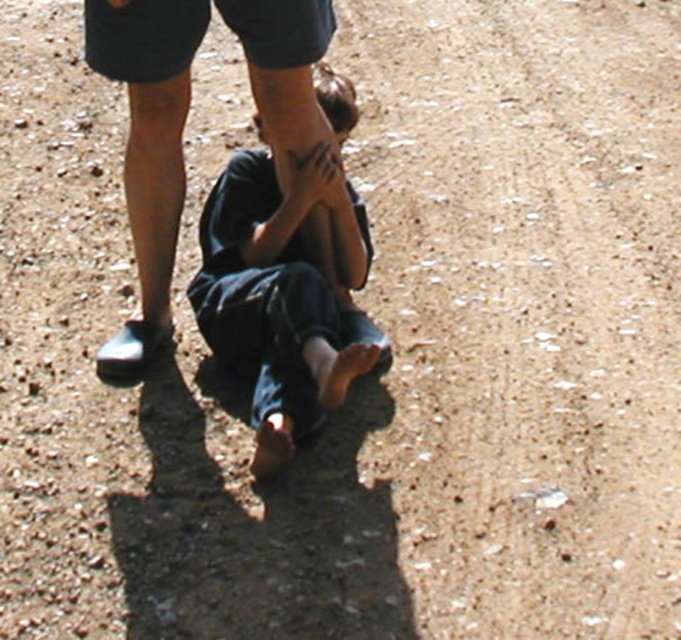
Between dark blue jeans at center and dark blue jeans at lower center, which one has more height?

dark blue jeans at center

Is point (247, 244) positioned before point (281, 88)?

No, (247, 244) is behind (281, 88).

Where is `dark blue jeans at center`? This screenshot has height=640, width=681. dark blue jeans at center is located at coordinates (281, 300).